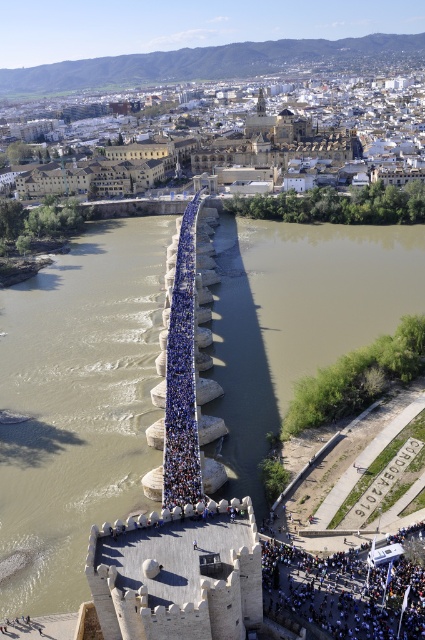
In the scene shown: Who is lower down, brown sedimentary stone bridge at center or brown muddy water at center?

Positioned lower is brown sedimentary stone bridge at center.

Does brown sedimentary stone bridge at center appear over brown muddy water at center?

Incorrect, brown sedimentary stone bridge at center is not positioned above brown muddy water at center.

The height and width of the screenshot is (640, 425). Describe the element at coordinates (76, 404) in the screenshot. I see `brown sedimentary stone bridge at center` at that location.

I want to click on brown sedimentary stone bridge at center, so click(76, 404).

Who is positioned more to the left, brown sedimentary stone bridge at center or blue fabric crowd at center?

From the viewer's perspective, brown sedimentary stone bridge at center appears more on the left side.

Which is more to the right, brown sedimentary stone bridge at center or blue fabric crowd at center?

blue fabric crowd at center

I want to click on brown sedimentary stone bridge at center, so click(x=76, y=404).

Where is `brown sedimentary stone bridge at center`? brown sedimentary stone bridge at center is located at coordinates (76, 404).

Is brown muddy water at center shorter than blue fabric crowd at center?

Incorrect, brown muddy water at center's height does not fall short of blue fabric crowd at center's.

Between point (402, 244) and point (399, 577), which one is positioned behind?

The point (402, 244) is more distant.

The height and width of the screenshot is (640, 425). I want to click on brown muddy water at center, so click(297, 317).